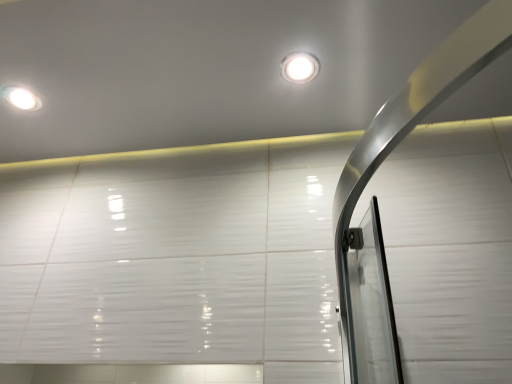
The image size is (512, 384). What do you see at coordinates (20, 98) in the screenshot?
I see `matte white droplight at upper left, positioned as the 2th droplight in front-to-back order` at bounding box center [20, 98].

Image resolution: width=512 pixels, height=384 pixels. What are the coordinates of `matte white droplight at upper left, positioned as the 2th droplight in front-to-back order` in the screenshot? It's located at (20, 98).

Where is `white glossy droplight at upper center, the second droplight in the left-to-right sequence`? The image size is (512, 384). white glossy droplight at upper center, the second droplight in the left-to-right sequence is located at coordinates (300, 67).

The height and width of the screenshot is (384, 512). What do you see at coordinates (300, 67) in the screenshot?
I see `white glossy droplight at upper center, the 1th droplight viewed from the front` at bounding box center [300, 67].

Measure the distance between white glossy droplight at upper center, the 1th droplight viewed from the front, and camera.

white glossy droplight at upper center, the 1th droplight viewed from the front, is 37.99 inches from camera.

At what (x,y) coordinates should I click in order to perform the action: click on matte white droplight at upper left, which is the 2th droplight from right to left. Please return your answer as a coordinate pair (x, y). Looking at the image, I should click on (20, 98).

Is white glossy droplight at upper center, placed as the 2th droplight when sorted from back to front, to the left or to the right of matte white droplight at upper left, marked as the first droplight in a back-to-front arrangement, in the image?

white glossy droplight at upper center, placed as the 2th droplight when sorted from back to front, is positioned on matte white droplight at upper left, marked as the first droplight in a back-to-front arrangement,'s right side.

Based on the photo, is the position of white glossy droplight at upper center, placed as the 2th droplight when sorted from back to front, less distant than that of matte white droplight at upper left, which is the 2th droplight from right to left?

That is True.

Considering the points (296, 75) and (37, 104), which point is in front, point (296, 75) or point (37, 104)?

Point (296, 75)

From the image's perspective, is white glossy droplight at upper center, the 1th droplight viewed from the front, beneath matte white droplight at upper left, positioned as the 2th droplight in front-to-back order?

Result: Incorrect, from the image's perspective, white glossy droplight at upper center, the 1th droplight viewed from the front, is higher than matte white droplight at upper left, positioned as the 2th droplight in front-to-back order.

From a real-world perspective, is white glossy droplight at upper center, the 1th droplight viewed from the front, physically located above or below matte white droplight at upper left, marked as the first droplight in a back-to-front arrangement?

white glossy droplight at upper center, the 1th droplight viewed from the front, is situated lower than matte white droplight at upper left, marked as the first droplight in a back-to-front arrangement, in the real world.

Which of these two, white glossy droplight at upper center, the 1th droplight viewed from the front, or matte white droplight at upper left, marked as the first droplight in a back-to-front arrangement, is wider?

With larger width is matte white droplight at upper left, marked as the first droplight in a back-to-front arrangement.

Considering the relative sizes of white glossy droplight at upper center, the 1th droplight positioned from the right, and matte white droplight at upper left, marked as the first droplight in a back-to-front arrangement, in the image provided, is white glossy droplight at upper center, the 1th droplight positioned from the right, shorter than matte white droplight at upper left, marked as the first droplight in a back-to-front arrangement,?

No, white glossy droplight at upper center, the 1th droplight positioned from the right, is not shorter than matte white droplight at upper left, marked as the first droplight in a back-to-front arrangement.

Between white glossy droplight at upper center, the second droplight in the left-to-right sequence, and matte white droplight at upper left, positioned as the 2th droplight in front-to-back order, which one has smaller size?

Smaller between the two is matte white droplight at upper left, positioned as the 2th droplight in front-to-back order.

Do you think white glossy droplight at upper center, the 1th droplight positioned from the right, is within matte white droplight at upper left, which is the 2th droplight from right to left, or outside of it?

white glossy droplight at upper center, the 1th droplight positioned from the right, is outside matte white droplight at upper left, which is the 2th droplight from right to left.

Can you see white glossy droplight at upper center, the 1th droplight positioned from the right, touching matte white droplight at upper left, marked as the first droplight in a back-to-front arrangement?

No, white glossy droplight at upper center, the 1th droplight positioned from the right, is not next to matte white droplight at upper left, marked as the first droplight in a back-to-front arrangement.

Is white glossy droplight at upper center, the 1th droplight positioned from the right, looking in the opposite direction of matte white droplight at upper left, placed as the 1th droplight when sorted from left to right?

No, matte white droplight at upper left, placed as the 1th droplight when sorted from left to right, is not at the back of white glossy droplight at upper center, the 1th droplight positioned from the right.

Can you tell me how much white glossy droplight at upper center, the 1th droplight viewed from the front, and matte white droplight at upper left, marked as the first droplight in a back-to-front arrangement, differ in facing direction?

The facing directions of white glossy droplight at upper center, the 1th droplight viewed from the front, and matte white droplight at upper left, marked as the first droplight in a back-to-front arrangement, are 0.00176 degrees apart.

Image resolution: width=512 pixels, height=384 pixels. I want to click on droplight located on the right of matte white droplight at upper left, placed as the 1th droplight when sorted from left to right, so click(300, 67).

Between matte white droplight at upper left, placed as the 1th droplight when sorted from left to right, and white glossy droplight at upper center, the 1th droplight positioned from the right, which one appears on the left side from the viewer's perspective?

matte white droplight at upper left, placed as the 1th droplight when sorted from left to right, is more to the left.

Which is behind, matte white droplight at upper left, positioned as the 2th droplight in front-to-back order, or white glossy droplight at upper center, the second droplight in the left-to-right sequence?

matte white droplight at upper left, positioned as the 2th droplight in front-to-back order, is further from the camera.

Considering the positions of point (17, 104) and point (295, 72), is point (17, 104) closer or farther from the camera than point (295, 72)?

Point (17, 104).

From the image's perspective, would you say matte white droplight at upper left, which is the 2th droplight from right to left, is shown under white glossy droplight at upper center, the second droplight in the left-to-right sequence?

Yes, from the image's perspective, matte white droplight at upper left, which is the 2th droplight from right to left, is beneath white glossy droplight at upper center, the second droplight in the left-to-right sequence.

From the picture: From a real-world perspective, which object stands above the other?

From a 3D spatial view, matte white droplight at upper left, marked as the first droplight in a back-to-front arrangement, is above.

Looking at this image, considering the sizes of objects matte white droplight at upper left, positioned as the 2th droplight in front-to-back order, and white glossy droplight at upper center, the second droplight in the left-to-right sequence, in the image provided, who is thinner, matte white droplight at upper left, positioned as the 2th droplight in front-to-back order, or white glossy droplight at upper center, the second droplight in the left-to-right sequence,?

white glossy droplight at upper center, the second droplight in the left-to-right sequence.

Which of these two, matte white droplight at upper left, placed as the 1th droplight when sorted from left to right, or white glossy droplight at upper center, the 1th droplight positioned from the right, stands taller?

white glossy droplight at upper center, the 1th droplight positioned from the right.

Between matte white droplight at upper left, placed as the 1th droplight when sorted from left to right, and white glossy droplight at upper center, the 1th droplight viewed from the front, which one has smaller size?

Smaller between the two is matte white droplight at upper left, placed as the 1th droplight when sorted from left to right.

Would you say white glossy droplight at upper center, placed as the 2th droplight when sorted from back to front, is part of matte white droplight at upper left, which is the 2th droplight from right to left,'s contents?

Actually, white glossy droplight at upper center, placed as the 2th droplight when sorted from back to front, is outside matte white droplight at upper left, which is the 2th droplight from right to left.

Looking at this image, is matte white droplight at upper left, which is the 2th droplight from right to left, touching white glossy droplight at upper center, the second droplight in the left-to-right sequence?

No, matte white droplight at upper left, which is the 2th droplight from right to left, is not in contact with white glossy droplight at upper center, the second droplight in the left-to-right sequence.

Looking at this image, is matte white droplight at upper left, marked as the first droplight in a back-to-front arrangement, oriented away from white glossy droplight at upper center, the 1th droplight viewed from the front?

No, matte white droplight at upper left, marked as the first droplight in a back-to-front arrangement, is not facing away from white glossy droplight at upper center, the 1th droplight viewed from the front.

What's the angular difference between matte white droplight at upper left, placed as the 1th droplight when sorted from left to right, and white glossy droplight at upper center, placed as the 2th droplight when sorted from back to front,'s facing directions?

0.00176 degrees separate the facing orientations of matte white droplight at upper left, placed as the 1th droplight when sorted from left to right, and white glossy droplight at upper center, placed as the 2th droplight when sorted from back to front.

You are a GUI agent. You are given a task and a screenshot of the screen. Output one action in this format:
    pyautogui.click(x=<x>, y=<y>)
    Task: Click on the droplight that appears in front of the matte white droplight at upper left, which is the 2th droplight from right to left
    The height and width of the screenshot is (384, 512).
    Given the screenshot: What is the action you would take?
    pyautogui.click(x=300, y=67)

Where is `droplight in front of the matte white droplight at upper left, marked as the first droplight in a back-to-front arrangement`? The width and height of the screenshot is (512, 384). droplight in front of the matte white droplight at upper left, marked as the first droplight in a back-to-front arrangement is located at coordinates pyautogui.click(x=300, y=67).

You are a GUI agent. You are given a task and a screenshot of the screen. Output one action in this format:
    pyautogui.click(x=<x>, y=<y>)
    Task: Click on the droplight above the white glossy droplight at upper center, the second droplight in the left-to-right sequence (from a real-world perspective)
    The height and width of the screenshot is (384, 512).
    Given the screenshot: What is the action you would take?
    pyautogui.click(x=20, y=98)